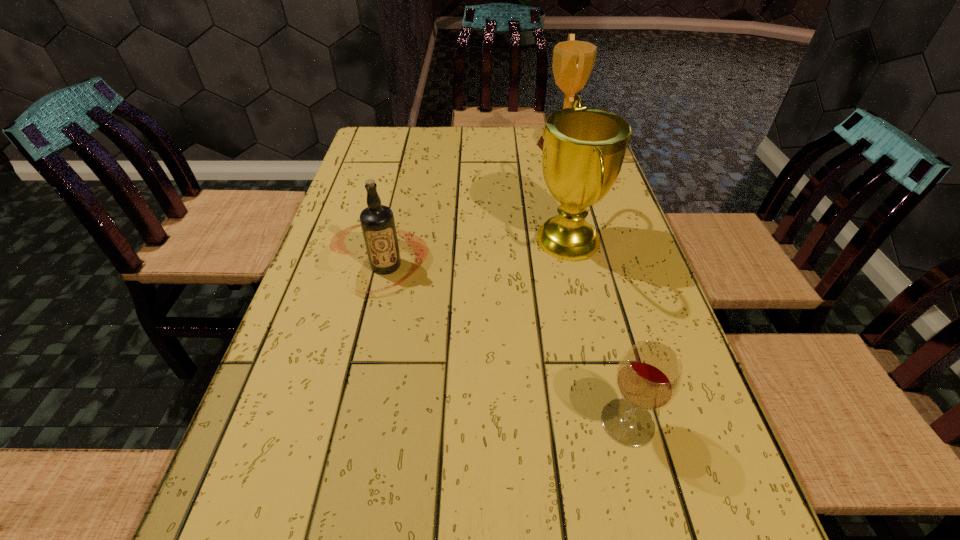
Find the location of a particular element. Image resolution: width=960 pixels, height=540 pixels. free spot located on the shiny surface of the nearer award is located at coordinates (384, 241).

The width and height of the screenshot is (960, 540). Identify the location of free space located on the shiny surface of the nearer award. (505, 241).

The image size is (960, 540). I want to click on free space located on the label of the root beer, so click(339, 474).

Identify the location of free space located 0.060m on the back of the wineglass. The height and width of the screenshot is (540, 960). (614, 370).

The image size is (960, 540). What are the coordinates of `object that is at the far edge` in the screenshot? It's located at (573, 61).

Identify the location of object that is positioned at the left edge. The width and height of the screenshot is (960, 540). (377, 221).

Find the location of a particular element. wineglass that is positioned at the right edge is located at coordinates (649, 375).

What are the coordinates of `object situated at the far right corner` in the screenshot? It's located at (573, 61).

This screenshot has width=960, height=540. In the image, there is a desktop. In order to click on free space at the far edge in this screenshot , I will do pyautogui.click(x=416, y=142).

Where is `free spot at the left edge of the desktop`? The width and height of the screenshot is (960, 540). free spot at the left edge of the desktop is located at coordinates (287, 325).